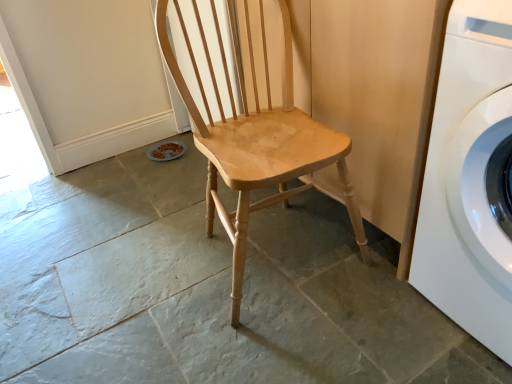
Image resolution: width=512 pixels, height=384 pixels. I want to click on free space in front of natural wood chair at center, so click(x=302, y=348).